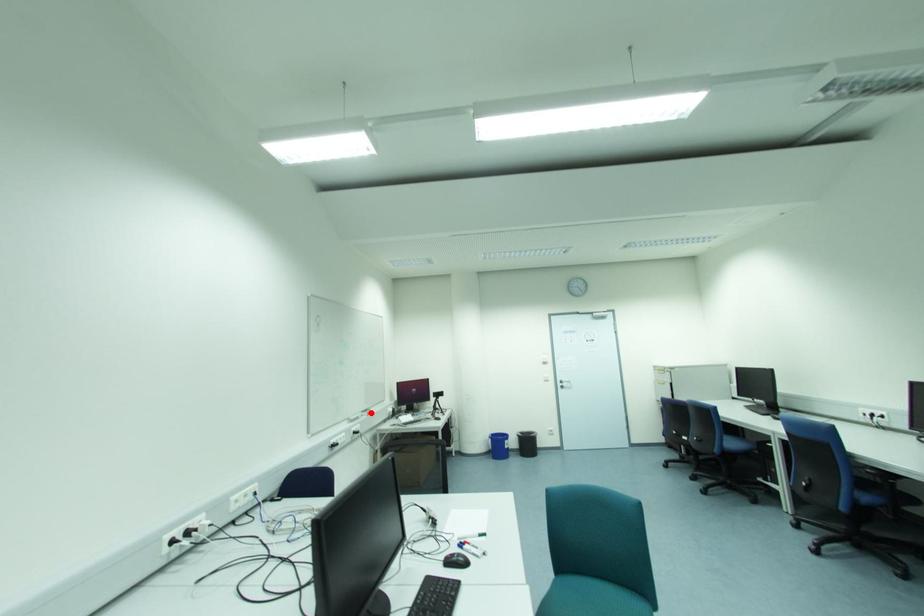
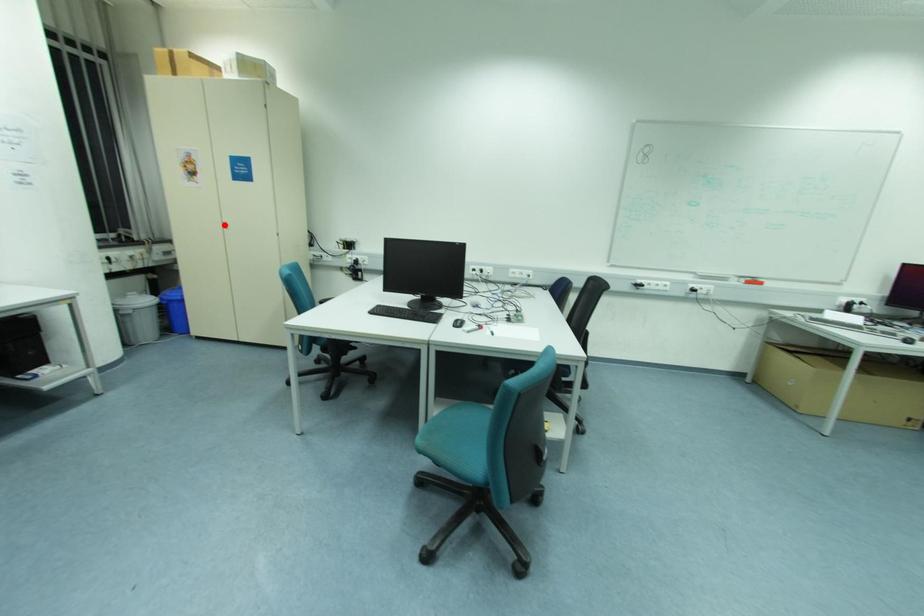
I am providing you with two images of the same scene from different viewpoints. A red point is marked on the first image and another point is marked on the second image. Are the points marked in image1 and image2 representing the same 3D position?

No